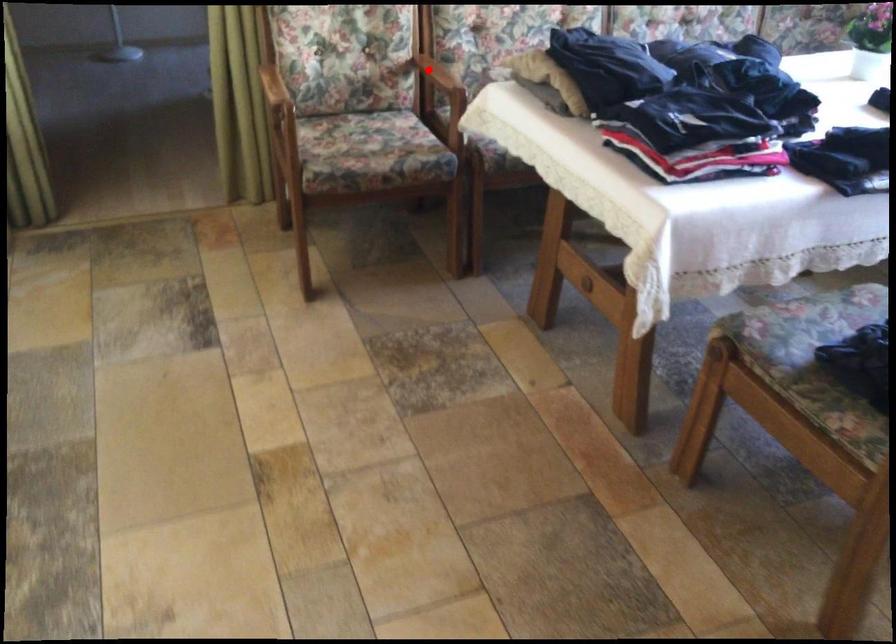
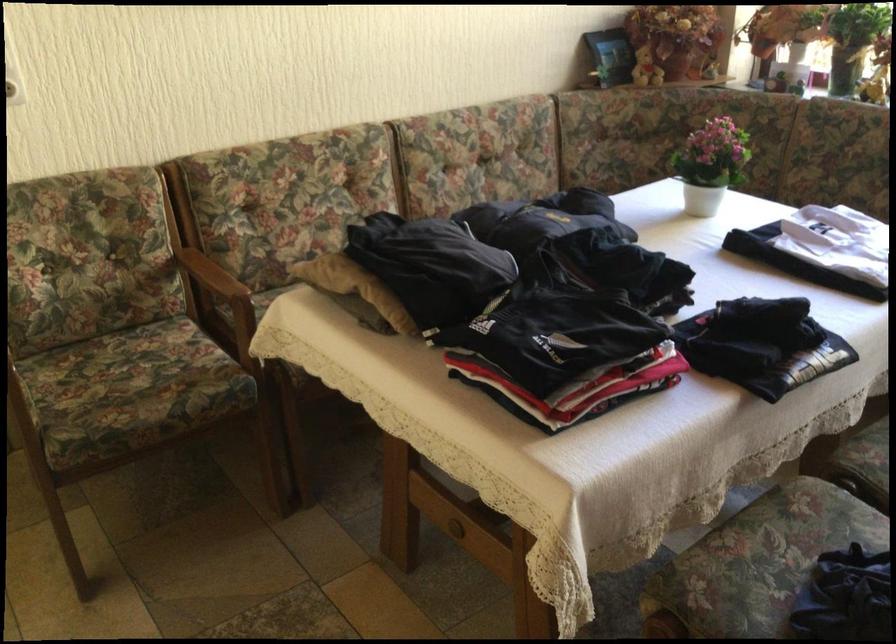
Question: I am providing you with two images of the same scene from different viewpoints. Given a red point in image1, look at the same physical point in image2. Is it:

Choices:
 (A) Closer to the viewpoint
 (B) Farther from the viewpoint

Answer: (A)